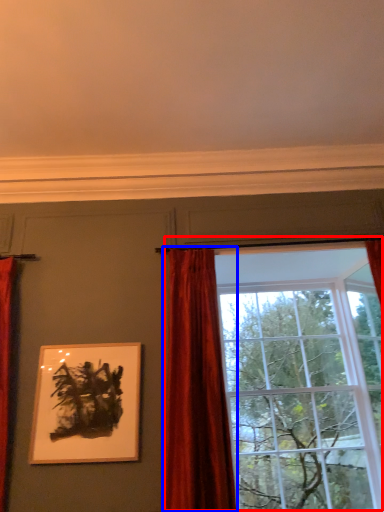
Question: Which point is further to the camera, window (highlighted by a red box) or curtain (highlighted by a blue box)?

Choices:
 (A) window
 (B) curtain

Answer: (A)